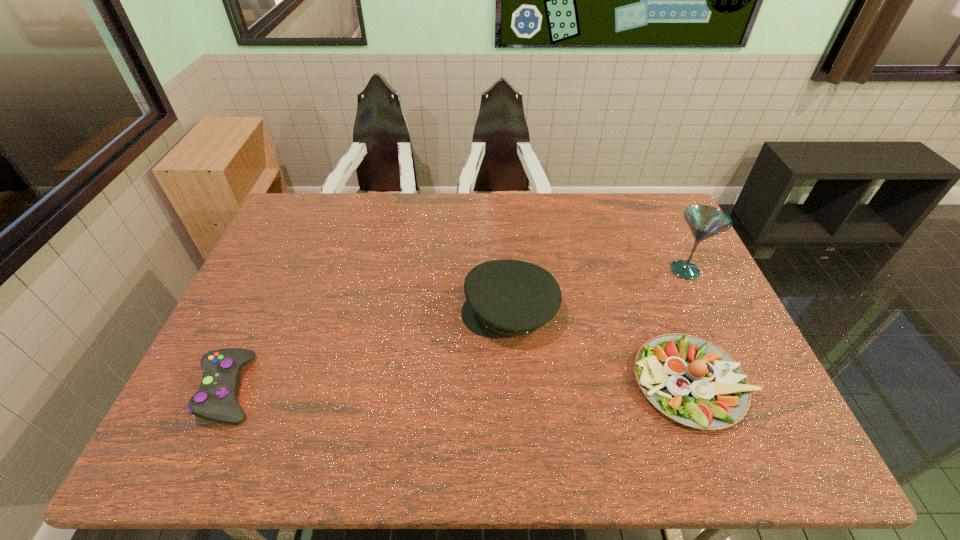
Locate an element on the screen. This screenshot has height=540, width=960. vacant space that satisfies the following two spatial constraints: 1. on the back side of the control; 2. on the right side of the tallest object is located at coordinates (284, 270).

Identify the location of vacant point that satisfies the following two spatial constraints: 1. on the front side of the tallest object; 2. on the front-facing side of the third shortest object. (705, 313).

Where is `free point that satisfies the following two spatial constraints: 1. on the front-facing side of the second tallest object; 2. on the front side of the control`? This screenshot has width=960, height=540. free point that satisfies the following two spatial constraints: 1. on the front-facing side of the second tallest object; 2. on the front side of the control is located at coordinates (515, 388).